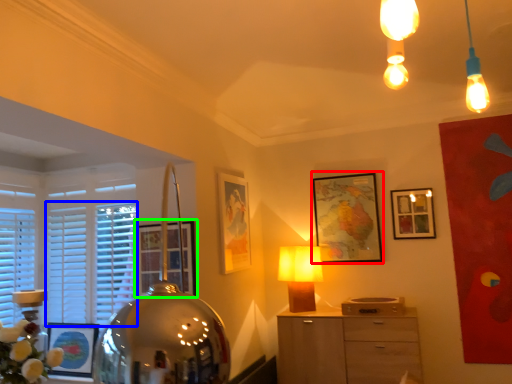
Question: Considering the real-world distances, which object is closest to picture frame (highlighted by a red box)? blind (highlighted by a blue box) or picture frame (highlighted by a green box).

Choices:
 (A) blind
 (B) picture frame

Answer: (B)